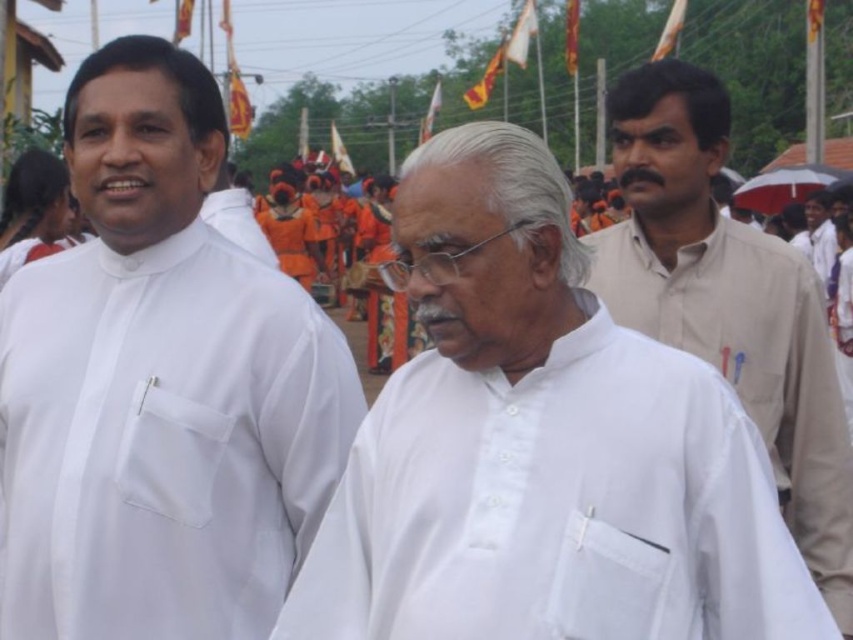
You are at the event and want to greet the person wearing the beige cotton shirt at right. Which direction should you move relative to the white cotton shirt at center?

The beige cotton shirt at right is positioned to the right of the white cotton shirt at center. Therefore, you should move to the right side of the white cotton shirt at center to reach the beige cotton shirt at right.

You are a photographer at the event and want to capture a clear photo of the white cotton shirt at right. However, the beige cotton shirt at right is blocking your view. Can you adjust your position to take the photo without moving the shirts?

The beige cotton shirt at right is in front of the white cotton shirt at right, so you cannot take a clear photo of the white cotton shirt at right without moving the beige cotton shirt at right.

You are a photographer at the event and want to ensure both the white matte shirt at left and beige cotton shirt at right are visible in your photo. Based on their heights, which shirt should you focus on to ensure both are fully captured?

The white matte shirt at left is taller than the beige cotton shirt at right. To ensure both are fully captured, focus on the white matte shirt at left as it is taller, allowing the shorter beige cotton shirt at right to be visible in the frame.